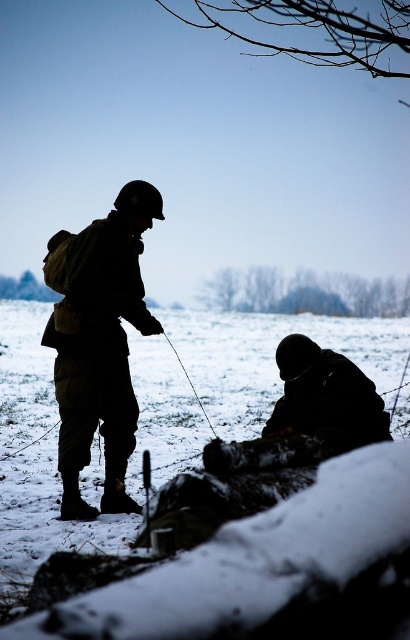
Question: Which object is positioned closest to the white powdery snow at lower center?

Choices:
 (A) black matte uniform at center
 (B) dark matte uniform at lower right

Answer: (A)

Question: Which object is closer to the camera taking this photo?

Choices:
 (A) dark matte uniform at lower right
 (B) white powdery snow at lower center
 (C) black matte uniform at center

Answer: (B)

Question: In this image, where is white powdery snow at lower center located relative to black matte uniform at center?

Choices:
 (A) right
 (B) left

Answer: (A)

Question: Where is black matte uniform at center located in relation to dark matte uniform at lower right in the image?

Choices:
 (A) left
 (B) right

Answer: (A)

Question: Among these points, which one is farthest from the camera?

Choices:
 (A) (75, 435)
 (B) (195, 371)

Answer: (B)

Question: Is white powdery snow at lower center wider than black matte uniform at center?

Choices:
 (A) no
 (B) yes

Answer: (B)